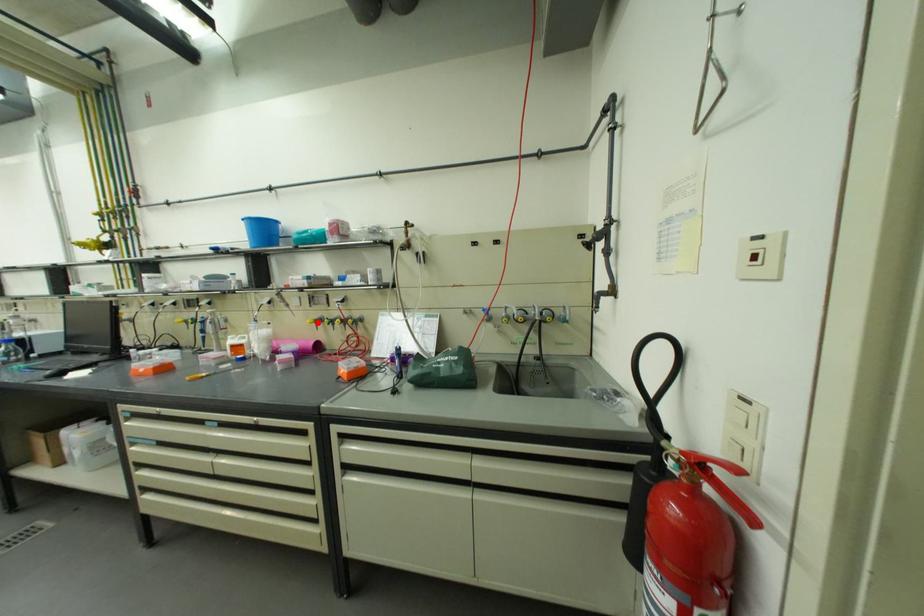
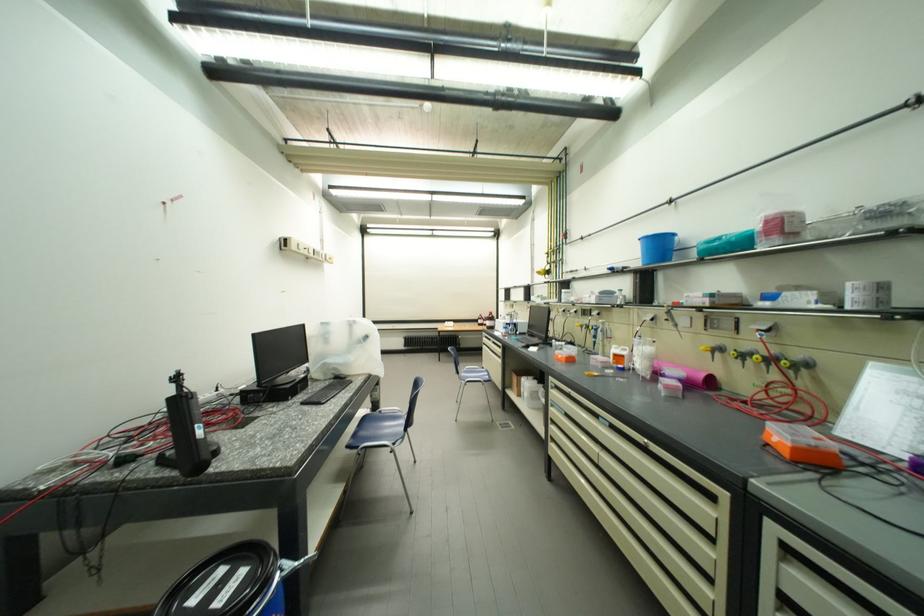
Question: I am providing you with two images of the same scene from different viewpoints. A red point is marked on the first image. At the location where the point appears in image 1, is it still visible in image 2?

Choices:
 (A) Yes
 (B) No

Answer: (A)